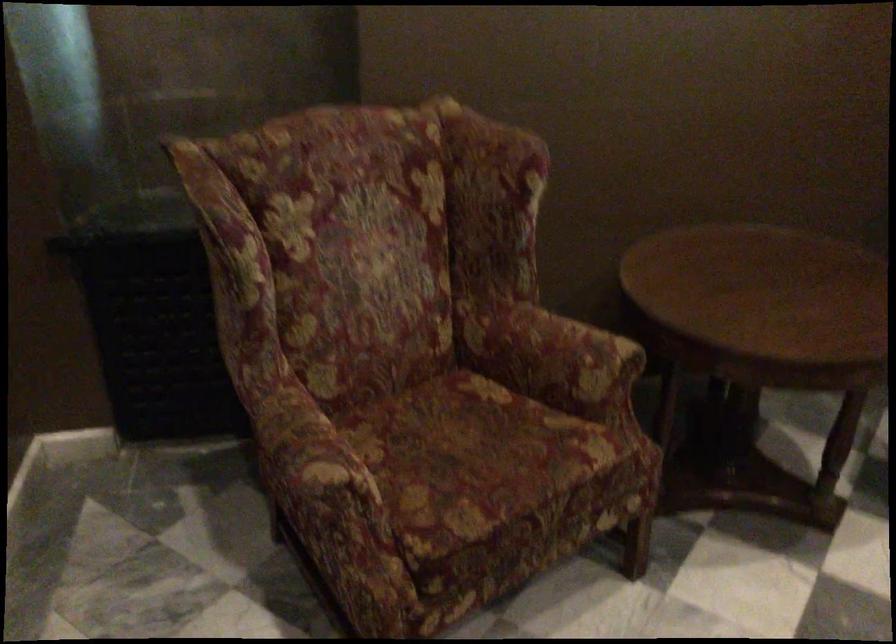
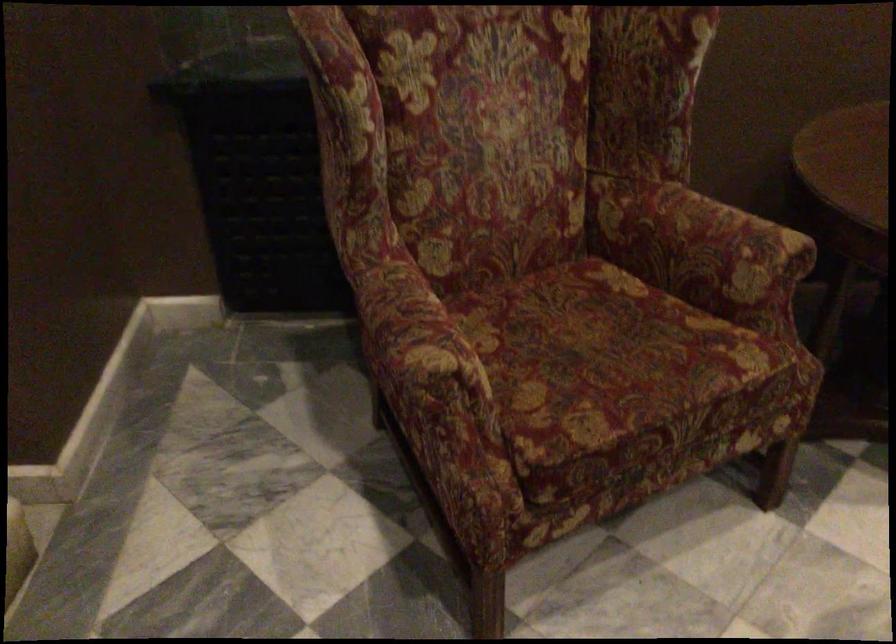
Locate, in the second image, the point that corresponds to the point at 553,352 in the first image.

(700, 243)